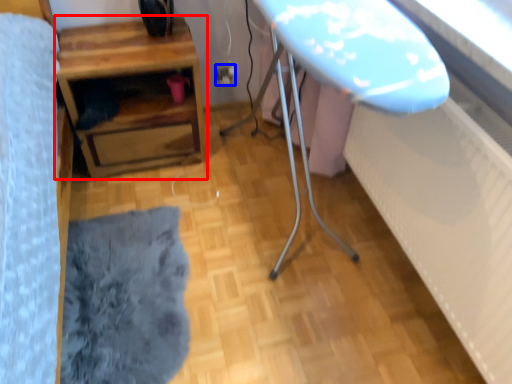
Question: Which object appears farthest to the camera in this image, table (highlighted by a red box) or electric outlet (highlighted by a blue box)?

Choices:
 (A) table
 (B) electric outlet

Answer: (B)